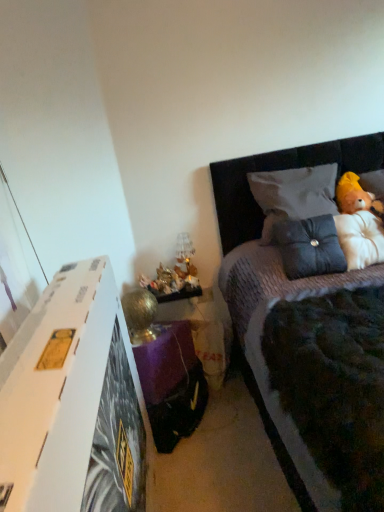
Question: Is suede-like black pillow at upper right, which ranks as the second pillow in top-to-bottom order, placed right next to white cardboard at left?

Choices:
 (A) yes
 (B) no

Answer: (B)

Question: From the image's perspective, is suede-like black pillow at upper right, positioned as the 1th pillow in bottom-to-top order, beneath white cardboard at left?

Choices:
 (A) yes
 (B) no

Answer: (B)

Question: Can you confirm if suede-like black pillow at upper right, which ranks as the second pillow in top-to-bottom order, is smaller than white cardboard at left?

Choices:
 (A) no
 (B) yes

Answer: (B)

Question: Considering the relative sizes of suede-like black pillow at upper right, positioned as the 1th pillow in bottom-to-top order, and white cardboard at left in the image provided, is suede-like black pillow at upper right, positioned as the 1th pillow in bottom-to-top order, taller than white cardboard at left?

Choices:
 (A) yes
 (B) no

Answer: (B)

Question: Does suede-like black pillow at upper right, positioned as the 1th pillow in bottom-to-top order, have a lesser width compared to white cardboard at left?

Choices:
 (A) no
 (B) yes

Answer: (B)

Question: Is suede-like black pillow at upper right, which ranks as the second pillow in top-to-bottom order, wider or thinner than velvet grey bed at upper right?

Choices:
 (A) wide
 (B) thin

Answer: (B)

Question: Relative to velvet grey bed at upper right, is suede-like black pillow at upper right, which ranks as the second pillow in top-to-bottom order, in front or behind?

Choices:
 (A) front
 (B) behind

Answer: (B)

Question: Is point (327, 232) positioned closer to the camera than point (244, 217)?

Choices:
 (A) farther
 (B) closer

Answer: (B)

Question: Considering the positions of suede-like black pillow at upper right, positioned as the 1th pillow in bottom-to-top order, and velvet grey bed at upper right in the image, is suede-like black pillow at upper right, positioned as the 1th pillow in bottom-to-top order, taller or shorter than velvet grey bed at upper right?

Choices:
 (A) short
 (B) tall

Answer: (A)

Question: Would you say white cardboard at left is to the left or to the right of fluffy white teddy bear at upper right in the picture?

Choices:
 (A) right
 (B) left

Answer: (B)

Question: Looking at the image, does white cardboard at left seem bigger or smaller compared to fluffy white teddy bear at upper right?

Choices:
 (A) big
 (B) small

Answer: (A)

Question: From the image's perspective, is white cardboard at left positioned above or below fluffy white teddy bear at upper right?

Choices:
 (A) above
 (B) below

Answer: (B)

Question: Is point (104, 407) positioned closer to the camera than point (362, 261)?

Choices:
 (A) closer
 (B) farther

Answer: (A)

Question: Is dark gray textured pillow at upper right, which is counted as the 2th pillow, starting from the bottom, to the left or to the right of fluffy white teddy bear at upper right in the image?

Choices:
 (A) left
 (B) right

Answer: (A)

Question: Is point (317, 211) closer or farther from the camera than point (349, 199)?

Choices:
 (A) closer
 (B) farther

Answer: (A)